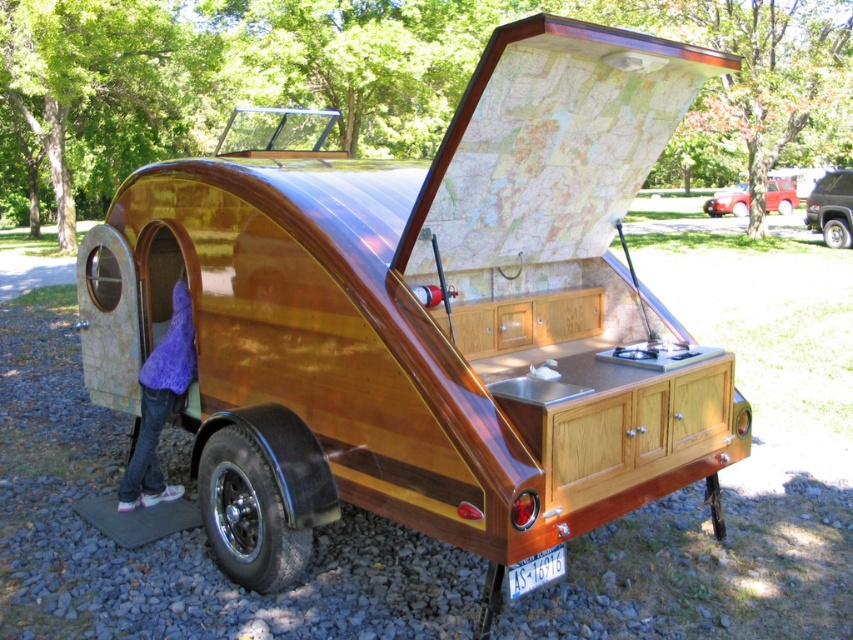
Question: Can you confirm if purple fuzzy hat at lower left is positioned to the left of metallic silver suv at upper right?

Choices:
 (A) yes
 (B) no

Answer: (A)

Question: Which point is farther to the camera?

Choices:
 (A) purple fuzzy hat at lower left
 (B) metallic red car at upper right

Answer: (B)

Question: Which point appears closest to the camera in this image?

Choices:
 (A) (740, 209)
 (B) (178, 355)

Answer: (B)

Question: Can you confirm if metallic silver suv at upper right is positioned to the left of metallic red car at upper right?

Choices:
 (A) no
 (B) yes

Answer: (B)

Question: Is metallic silver suv at upper right to the right of metallic red car at upper right from the viewer's perspective?

Choices:
 (A) yes
 (B) no

Answer: (B)

Question: Which object is the farthest from the metallic red car at upper right?

Choices:
 (A) metallic silver suv at upper right
 (B) purple fuzzy hat at lower left

Answer: (B)